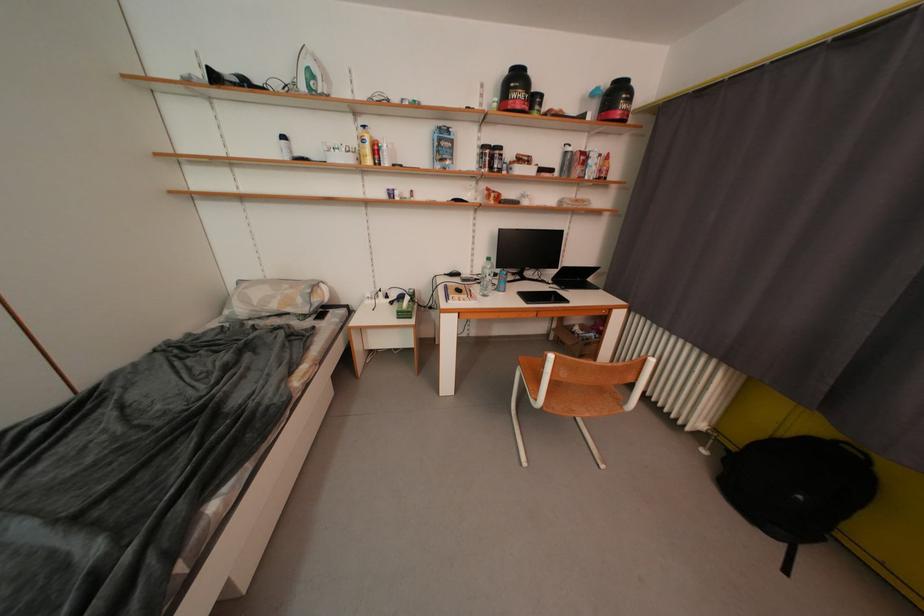
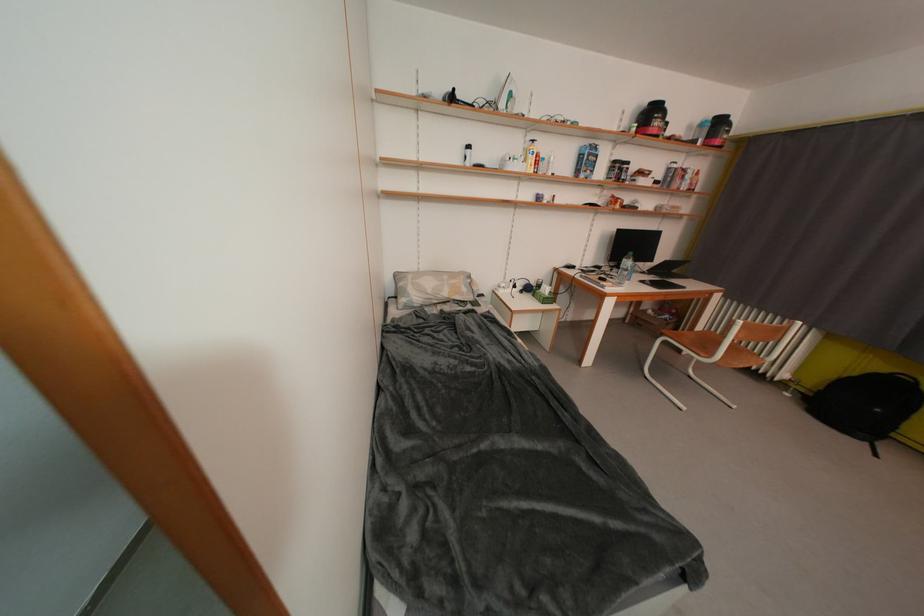
Where in the second image is the point corresponding to point (224, 81) from the first image?

(459, 100)